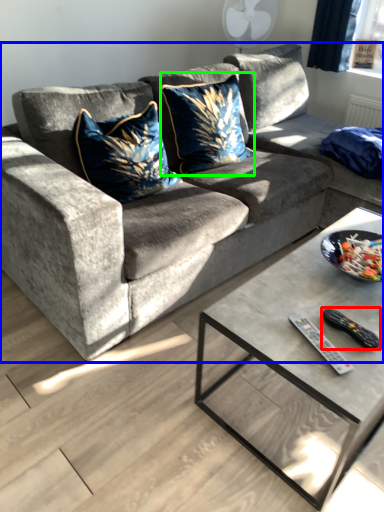
Question: Which is nearer to the remote (highlighted by a red box)? studio couch (highlighted by a blue box) or throw pillow (highlighted by a green box).

Choices:
 (A) studio couch
 (B) throw pillow

Answer: (A)